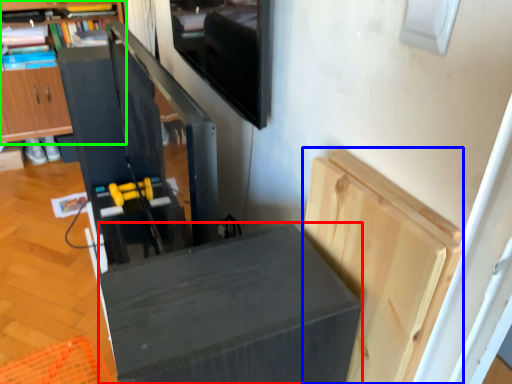
Question: Which is nearer to the furniture (highlighted by a red box)? cabinetry (highlighted by a blue box) or cabinetry (highlighted by a green box).

Choices:
 (A) cabinetry
 (B) cabinetry

Answer: (A)